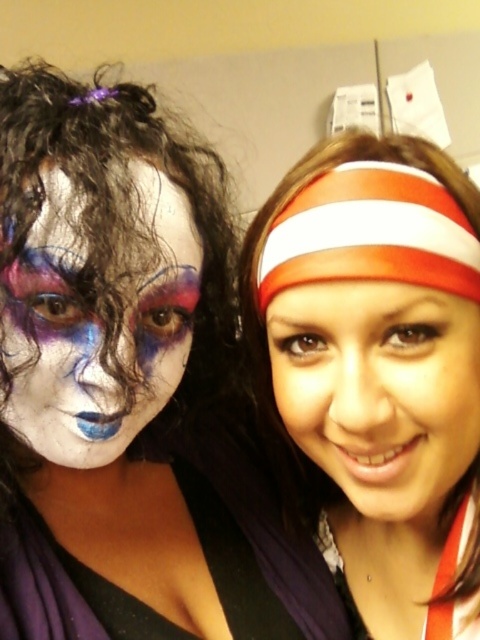
Question: Based on their relative distances, which object is farther from the smooth skin face at center?

Choices:
 (A) white/red striped headband at upper right
 (B) matte white headband at upper right
 (C) matte white face paint at left

Answer: (B)

Question: Can you confirm if matte white headband at upper right is thinner than matte white face paint at left?

Choices:
 (A) no
 (B) yes

Answer: (A)

Question: Which point is closer to the camera?

Choices:
 (A) (199, 352)
 (B) (252, 340)
 (C) (409, 529)
 (D) (82, 394)

Answer: (D)

Question: Can you confirm if matte white headband at upper right is thinner than smooth skin face at center?

Choices:
 (A) no
 (B) yes

Answer: (A)

Question: Can you confirm if smooth skin face at center is thinner than matte white face paint at left?

Choices:
 (A) yes
 (B) no

Answer: (B)

Question: Which point is closer to the camera taking this photo?

Choices:
 (A) (347, 492)
 (B) (165, 241)
 (C) (59, 422)
 (D) (431, 346)

Answer: (D)